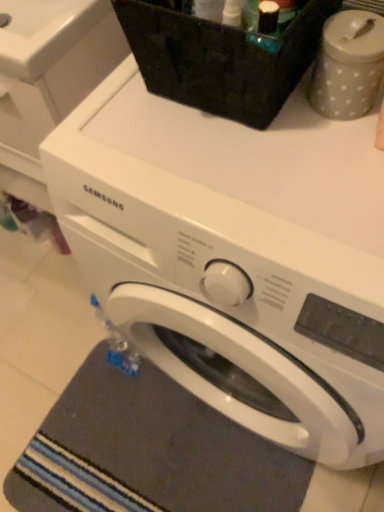
Identify the location of vacant space that is to the left of gray dotted container at upper right. (229, 143).